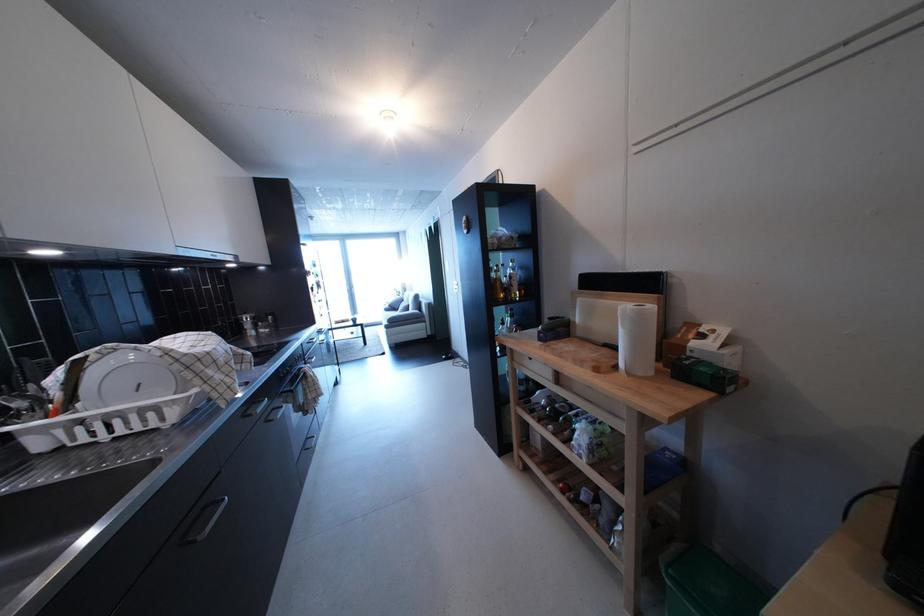
At what (x,y) coordinates should I click in order to perform the action: click on small green box. Please return your answer as a coordinate pair (x, y). The height and width of the screenshot is (616, 924). Looking at the image, I should click on (553, 329).